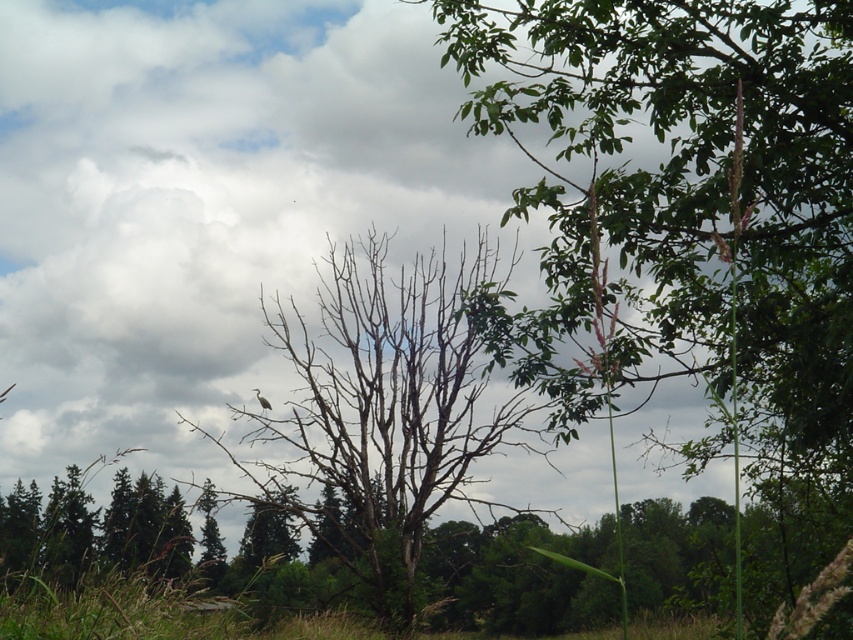
Consider the image. Which is more to the left, green leafy tree at upper right or bare branches at center?

Positioned to the left is bare branches at center.

Is point (670, 289) positioned before point (292, 464)?

That is True.

Does point (664, 240) lie in front of point (384, 285)?

Yes, it is.

Where is `green leafy tree at upper right`? The height and width of the screenshot is (640, 853). green leafy tree at upper right is located at coordinates (695, 212).